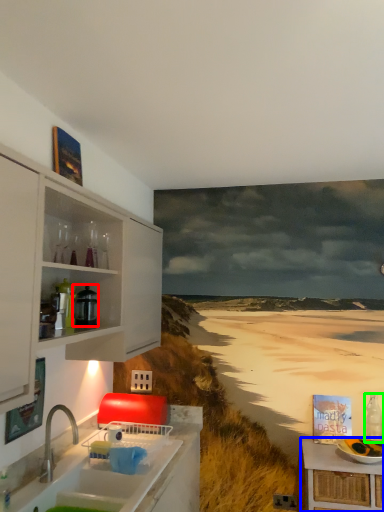
Question: Which object is positioned farthest from appliance (highlighted by a red box)? Select from table (highlighted by a blue box) and bottle (highlighted by a green box).

Choices:
 (A) table
 (B) bottle

Answer: (B)